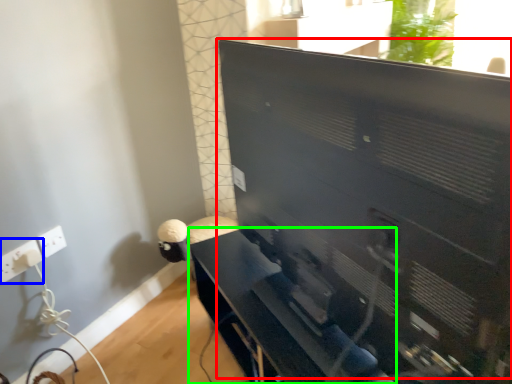
Question: Estimate the real-world distances between objects in this image. Which object is closer to computer monitor (highlighted by a red box), electric outlet (highlighted by a blue box) or furniture (highlighted by a green box)?

Choices:
 (A) electric outlet
 (B) furniture

Answer: (B)